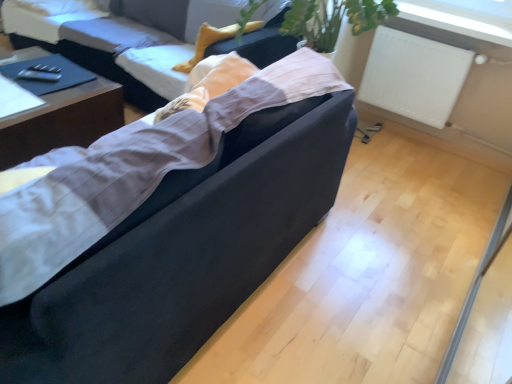
I want to click on suede-like black couch at center, the second studio couch viewed from the back, so click(165, 230).

What are the coordinates of `velvet black couch at center, positioned as the second studio couch in front-to-back order` in the screenshot? It's located at (128, 42).

Consider the image. Would you say dark wood table at left is outside suede-like black couch at center, the second studio couch viewed from the back?

dark wood table at left is positioned outside suede-like black couch at center, the second studio couch viewed from the back.

In terms of size, does dark wood table at left appear bigger or smaller than suede-like black couch at center, the first studio couch positioned from the front?

Considering their sizes, dark wood table at left takes up less space than suede-like black couch at center, the first studio couch positioned from the front.

Between dark wood table at left and suede-like black couch at center, the first studio couch positioned from the front, which one has less height?

With less height is dark wood table at left.

Does dark wood table at left touch suede-like black couch at center, the first studio couch positioned from the front?

No, dark wood table at left is not making contact with suede-like black couch at center, the first studio couch positioned from the front.

Is velvet black couch at center, marked as the first studio couch in a back-to-front arrangement, far away from dark wood table at left?

No, velvet black couch at center, marked as the first studio couch in a back-to-front arrangement, is in close proximity to dark wood table at left.

Where is `table that appears in front of the velvet black couch at center, marked as the first studio couch in a back-to-front arrangement`? Image resolution: width=512 pixels, height=384 pixels. table that appears in front of the velvet black couch at center, marked as the first studio couch in a back-to-front arrangement is located at coordinates (62, 121).

Would you say velvet black couch at center, marked as the first studio couch in a back-to-front arrangement, is inside or outside dark wood table at left?

velvet black couch at center, marked as the first studio couch in a back-to-front arrangement, exists outside the volume of dark wood table at left.

Considering the relative positions of dark wood table at left and white matte radiator at upper right in the image provided, is dark wood table at left in front of white matte radiator at upper right?

Yes, dark wood table at left is closer to the camera.

From the image's perspective, is dark wood table at left located beneath white matte radiator at upper right?

Indeed, from the image's perspective, dark wood table at left is shown beneath white matte radiator at upper right.

Locate an element on the screen. radiator on the right side of dark wood table at left is located at coordinates (414, 76).

Looking at this image, in terms of width, does white matte radiator at upper right look wider or thinner when compared to suede-like black couch at center, the first studio couch positioned from the front?

Clearly, white matte radiator at upper right has less width compared to suede-like black couch at center, the first studio couch positioned from the front.

Which of these two, white matte radiator at upper right or suede-like black couch at center, the second studio couch viewed from the back, stands taller?

Standing taller between the two is suede-like black couch at center, the second studio couch viewed from the back.

From a real-world perspective, is white matte radiator at upper right positioned under suede-like black couch at center, the second studio couch viewed from the back, based on gravity?

Yes, from a real-world perspective, white matte radiator at upper right is beneath suede-like black couch at center, the second studio couch viewed from the back.

From a real-world perspective, is suede-like black couch at center, the first studio couch positioned from the front, positioned above or below white matte radiator at upper right?

Clearly, from a real-world perspective, suede-like black couch at center, the first studio couch positioned from the front, is above white matte radiator at upper right.

Between point (110, 150) and point (431, 79), which one is positioned in front?

The point (110, 150) is in front.

Based on the photo, is suede-like black couch at center, the first studio couch positioned from the front, taller than white matte radiator at upper right?

Yes, suede-like black couch at center, the first studio couch positioned from the front, is taller than white matte radiator at upper right.

Can we say suede-like black couch at center, the first studio couch positioned from the front, lies outside white matte radiator at upper right?

Yes.

Would you say suede-like black couch at center, the first studio couch positioned from the front, is to the left or to the right of velvet black couch at center, positioned as the second studio couch in front-to-back order, in the picture?

suede-like black couch at center, the first studio couch positioned from the front, is to the right of velvet black couch at center, positioned as the second studio couch in front-to-back order.

Is suede-like black couch at center, the second studio couch viewed from the back, positioned with its back to velvet black couch at center, marked as the first studio couch in a back-to-front arrangement?

No, suede-like black couch at center, the second studio couch viewed from the back, is not facing the opposite direction of velvet black couch at center, marked as the first studio couch in a back-to-front arrangement.

Looking at this image, is suede-like black couch at center, the first studio couch positioned from the front, surrounding velvet black couch at center, positioned as the second studio couch in front-to-back order?

No, suede-like black couch at center, the first studio couch positioned from the front, does not contain velvet black couch at center, positioned as the second studio couch in front-to-back order.

Between suede-like black couch at center, the first studio couch positioned from the front, and velvet black couch at center, marked as the first studio couch in a back-to-front arrangement, which one has less height?

velvet black couch at center, marked as the first studio couch in a back-to-front arrangement, is shorter.

Does velvet black couch at center, positioned as the second studio couch in front-to-back order, turn towards white matte radiator at upper right?

No, velvet black couch at center, positioned as the second studio couch in front-to-back order, is not aimed at white matte radiator at upper right.

Is point (199, 28) positioned in front of point (374, 60)?

No, (199, 28) is further to viewer.

In the image, is velvet black couch at center, marked as the first studio couch in a back-to-front arrangement, positioned in front of or behind white matte radiator at upper right?

velvet black couch at center, marked as the first studio couch in a back-to-front arrangement, is in front of white matte radiator at upper right.

The width and height of the screenshot is (512, 384). I want to click on studio couch located in front of the dark wood table at left, so click(x=165, y=230).

From a real-world perspective, starting from the dark wood table at left, which studio couch is the 1st one vertically above it? Please provide its 2D coordinates.

[(128, 42)]

Estimate the real-world distances between objects in this image. Which object is further from white matte radiator at upper right, velvet black couch at center, marked as the first studio couch in a back-to-front arrangement, or dark wood table at left?

The object further to white matte radiator at upper right is dark wood table at left.

Considering their positions, is velvet black couch at center, marked as the first studio couch in a back-to-front arrangement, positioned further to dark wood table at left than suede-like black couch at center, the first studio couch positioned from the front?

Among the two, suede-like black couch at center, the first studio couch positioned from the front, is located further to dark wood table at left.

Considering their positions, is suede-like black couch at center, the first studio couch positioned from the front, positioned closer to white matte radiator at upper right than dark wood table at left?

suede-like black couch at center, the first studio couch positioned from the front, lies closer to white matte radiator at upper right than the other object.

Considering their positions, is dark wood table at left positioned closer to velvet black couch at center, marked as the first studio couch in a back-to-front arrangement, than suede-like black couch at center, the second studio couch viewed from the back?

dark wood table at left.

When comparing their distances from suede-like black couch at center, the first studio couch positioned from the front, does white matte radiator at upper right or velvet black couch at center, marked as the first studio couch in a back-to-front arrangement, seem further?

white matte radiator at upper right is further to suede-like black couch at center, the first studio couch positioned from the front.

From the image, which object appears to be nearer to dark wood table at left, white matte radiator at upper right or suede-like black couch at center, the second studio couch viewed from the back?

Based on the image, suede-like black couch at center, the second studio couch viewed from the back, appears to be nearer to dark wood table at left.

Looking at the image, which one is located further to suede-like black couch at center, the first studio couch positioned from the front, velvet black couch at center, marked as the first studio couch in a back-to-front arrangement, or dark wood table at left?

velvet black couch at center, marked as the first studio couch in a back-to-front arrangement, lies further to suede-like black couch at center, the first studio couch positioned from the front, than the other object.

Based on the photo, looking at the image, which one is located further to dark wood table at left, velvet black couch at center, marked as the first studio couch in a back-to-front arrangement, or white matte radiator at upper right?

The object further to dark wood table at left is white matte radiator at upper right.

Where is `studio couch between velvet black couch at center, positioned as the second studio couch in front-to-back order, and white matte radiator at upper right`? The image size is (512, 384). studio couch between velvet black couch at center, positioned as the second studio couch in front-to-back order, and white matte radiator at upper right is located at coordinates (165, 230).

Where is `table positioned between suede-like black couch at center, the first studio couch positioned from the front, and velvet black couch at center, marked as the first studio couch in a back-to-front arrangement, from near to far`? table positioned between suede-like black couch at center, the first studio couch positioned from the front, and velvet black couch at center, marked as the first studio couch in a back-to-front arrangement, from near to far is located at coordinates (62, 121).